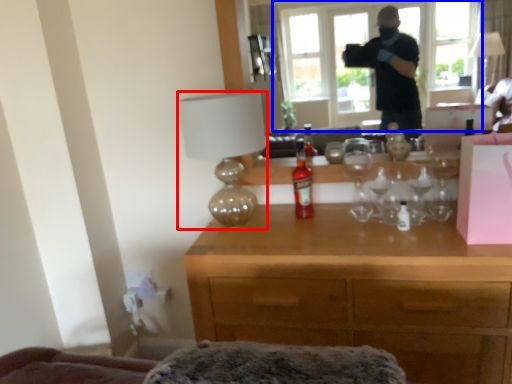
Question: Among these objects, which one is nearest to the camera, lamp (highlighted by a red box) or window (highlighted by a blue box)?

Choices:
 (A) lamp
 (B) window

Answer: (B)